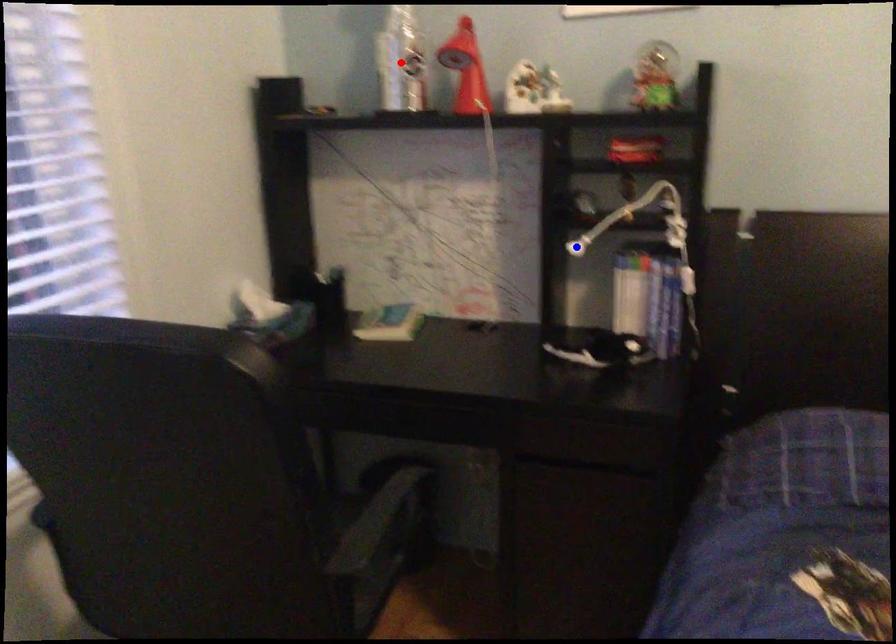
Question: In the image, two points are highlighted. Which point is nearer to the camera? Reply with the corresponding letter.

Choices:
 (A) blue point
 (B) red point

Answer: (A)